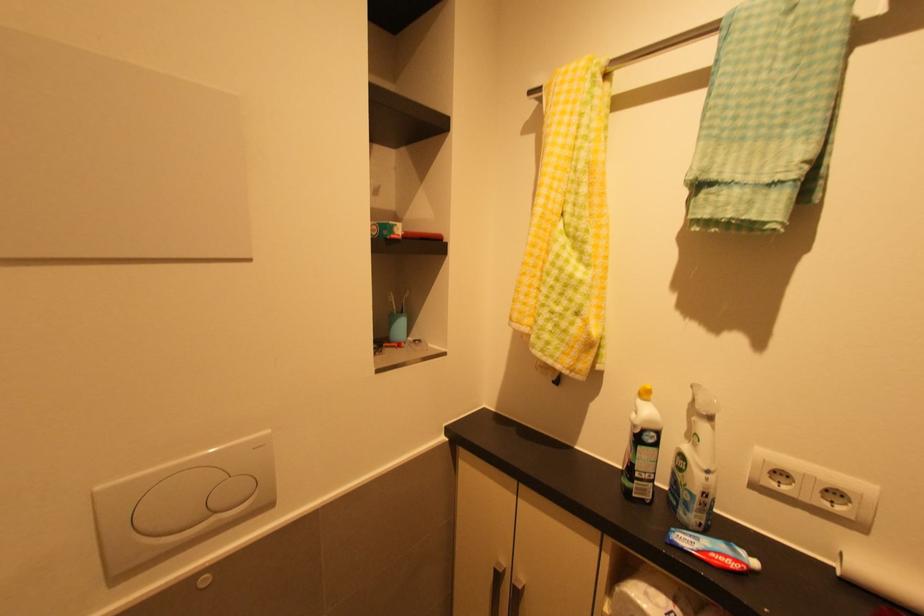
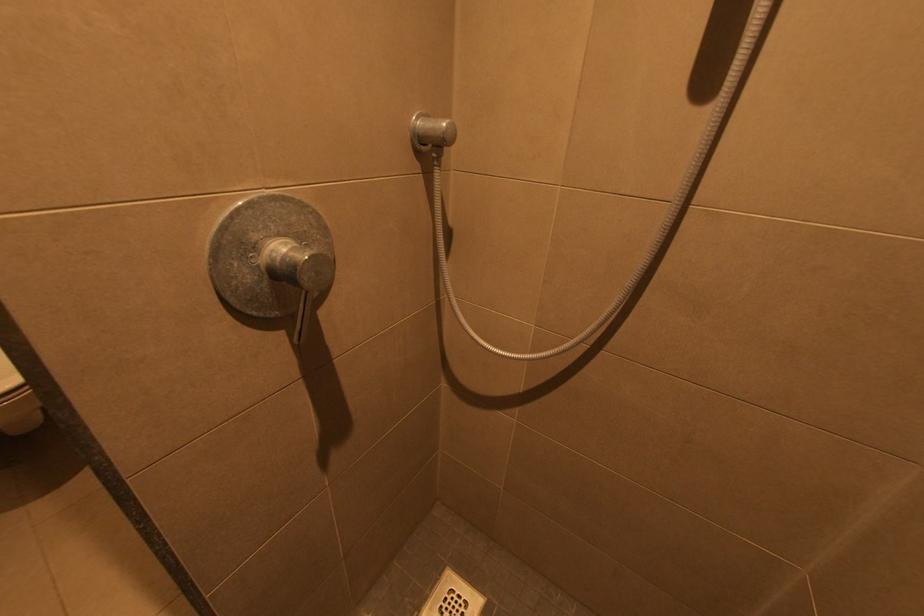
In a continuous first-person perspective shot, in which direction is the camera moving?

The cameraman moved toward right, backward.